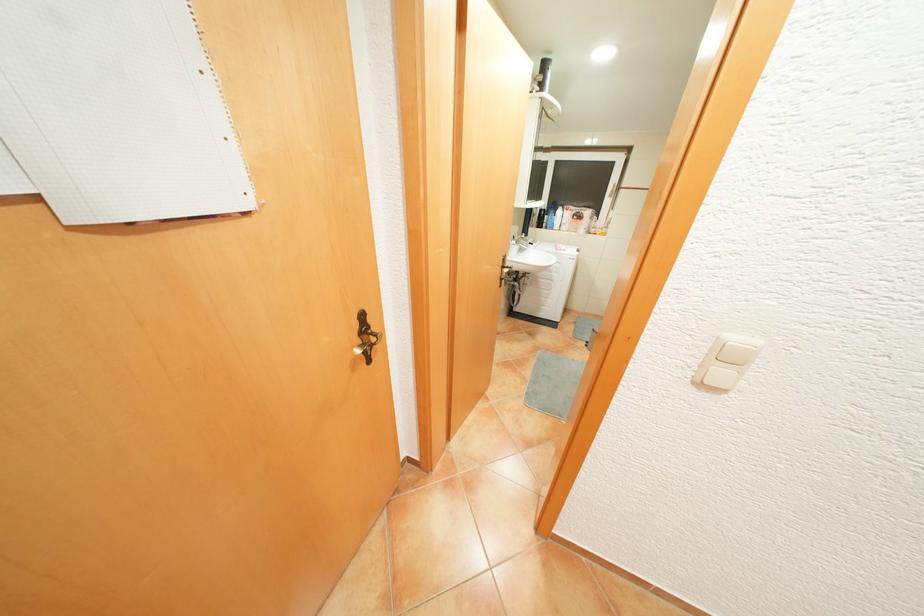
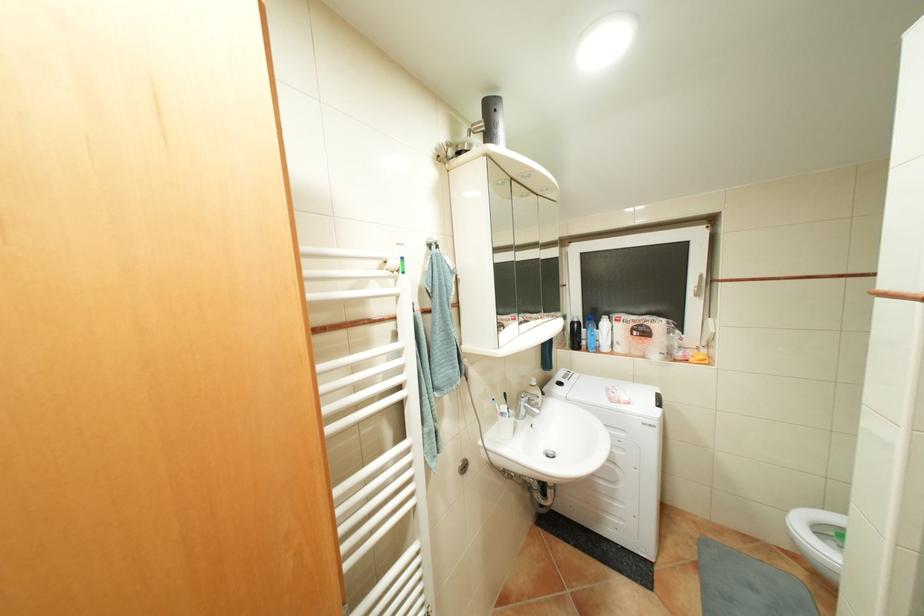
Find the pixel in the second image that matches point 602,230 in the first image.

(688, 354)